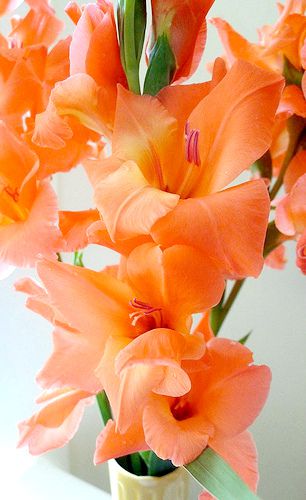
Where is `vase flowers are in`? This screenshot has width=306, height=500. vase flowers are in is located at coordinates (136, 483).